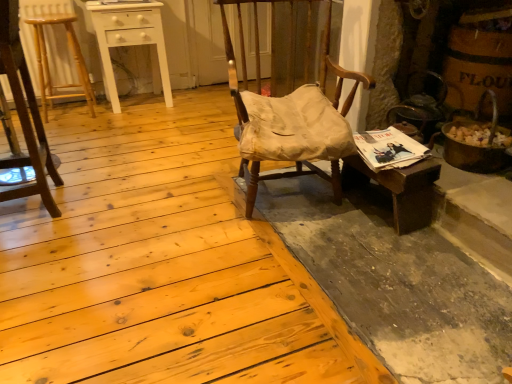
Find the location of a particular element. This screenshot has height=384, width=512. free space to the right of wooden stool at left, which is the 2th chair in right-to-left order is located at coordinates (106, 203).